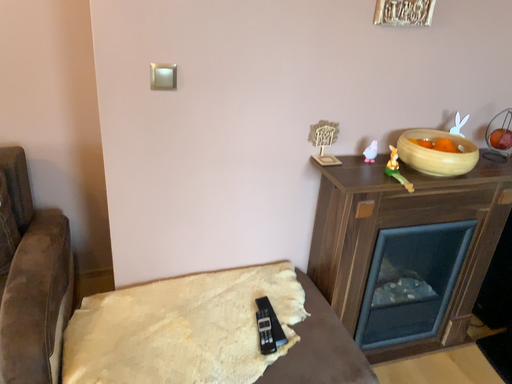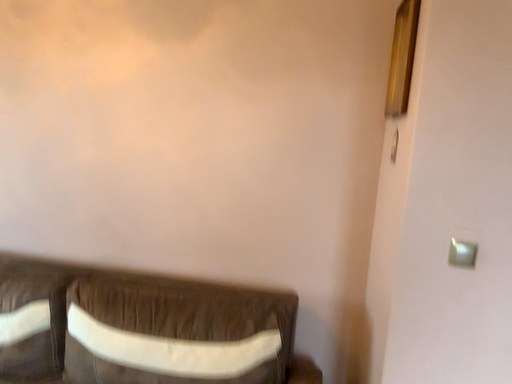
Question: Which way did the camera rotate in the video?

Choices:
 (A) rotated downward
 (B) rotated upward

Answer: (B)